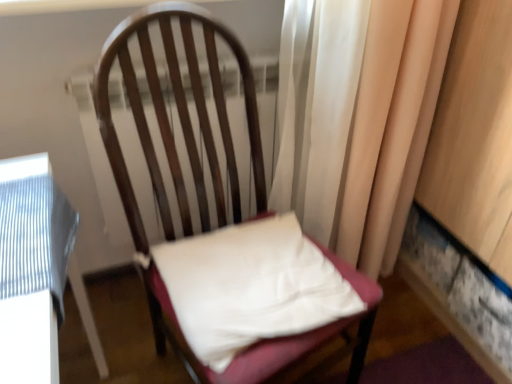
Question: Should I look upward or downward to see silky beige curtain at right?

Choices:
 (A) up
 (B) down

Answer: (A)

Question: Considering the relative sizes of white fabric pillow at center and silky beige curtain at right in the image provided, is white fabric pillow at center shorter than silky beige curtain at right?

Choices:
 (A) no
 (B) yes

Answer: (B)

Question: Is white fabric pillow at center in front of silky beige curtain at right?

Choices:
 (A) yes
 (B) no

Answer: (A)

Question: Does white fabric pillow at center have a lesser width compared to silky beige curtain at right?

Choices:
 (A) no
 (B) yes

Answer: (A)

Question: From the image's perspective, would you say white fabric pillow at center is positioned over silky beige curtain at right?

Choices:
 (A) no
 (B) yes

Answer: (A)

Question: Would you say white fabric pillow at center is a long distance from silky beige curtain at right?

Choices:
 (A) no
 (B) yes

Answer: (A)

Question: Is the depth of white fabric pillow at center greater than that of silky beige curtain at right?

Choices:
 (A) no
 (B) yes

Answer: (A)

Question: From the image's perspective, would you say wooden chair at center is shown under silky beige curtain at right?

Choices:
 (A) yes
 (B) no

Answer: (A)

Question: Considering the relative sizes of wooden chair at center and silky beige curtain at right in the image provided, is wooden chair at center bigger than silky beige curtain at right?

Choices:
 (A) no
 (B) yes

Answer: (B)

Question: Is wooden chair at center facing towards silky beige curtain at right?

Choices:
 (A) no
 (B) yes

Answer: (A)

Question: Does wooden chair at center have a greater width compared to silky beige curtain at right?

Choices:
 (A) no
 (B) yes

Answer: (B)

Question: From the image's perspective, is wooden chair at center located above silky beige curtain at right?

Choices:
 (A) yes
 (B) no

Answer: (B)

Question: Considering the relative positions of wooden chair at center and silky beige curtain at right in the image provided, is wooden chair at center to the right of silky beige curtain at right from the viewer's perspective?

Choices:
 (A) yes
 (B) no

Answer: (B)

Question: Is silky beige curtain at right facing towards white fabric pillow at center?

Choices:
 (A) yes
 (B) no

Answer: (B)